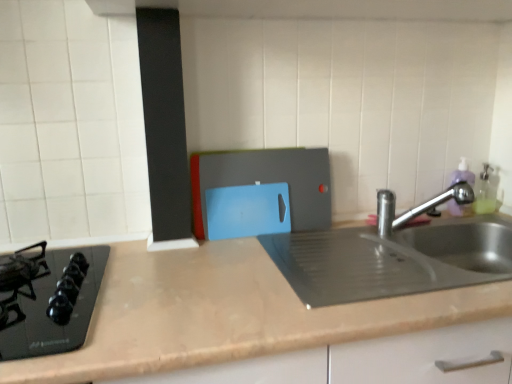
Question: Is black glass gas stove at left to the left or to the right of satin nickel faucet at right in the image?

Choices:
 (A) left
 (B) right

Answer: (A)

Question: From the image's perspective, is black glass gas stove at left positioned above or below satin nickel faucet at right?

Choices:
 (A) below
 (B) above

Answer: (A)

Question: Estimate the real-world distances between objects in this image. Which object is closer to the blue plastic cutting board at center?

Choices:
 (A) black glass gas stove at left
 (B) satin nickel faucet at right

Answer: (B)

Question: Which is nearer to the black glass gas stove at left?

Choices:
 (A) blue plastic cutting board at center
 (B) satin nickel faucet at right

Answer: (A)